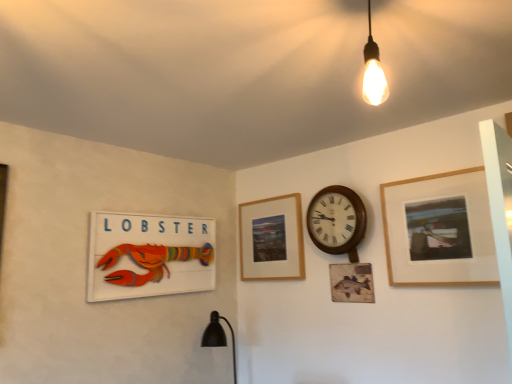
Question: Are wooden picture frame at center, which is the second picture frame in right-to-left order, and wooden lobster sign at left, positioned as the 3th picture frame in right-to-left order, far apart?

Choices:
 (A) yes
 (B) no

Answer: (B)

Question: From the image's perspective, is wooden picture frame at center, which ranks as the 2th picture frame in left-to-right order, on top of wooden lobster sign at left, marked as the first picture frame in a left-to-right arrangement?

Choices:
 (A) no
 (B) yes

Answer: (B)

Question: Is the depth of wooden picture frame at center, which ranks as the 2th picture frame in left-to-right order, greater than that of wooden lobster sign at left, positioned as the 3th picture frame in right-to-left order?

Choices:
 (A) no
 (B) yes

Answer: (B)

Question: From the image's perspective, is wooden picture frame at center, which is the second picture frame in right-to-left order, located beneath wooden lobster sign at left, positioned as the 3th picture frame in right-to-left order?

Choices:
 (A) yes
 (B) no

Answer: (B)

Question: Is wooden picture frame at center, which ranks as the 2th picture frame in left-to-right order, thinner than wooden lobster sign at left, positioned as the 3th picture frame in right-to-left order?

Choices:
 (A) yes
 (B) no

Answer: (A)

Question: From the image's perspective, relative to wooden lobster sign at left, positioned as the 3th picture frame in right-to-left order, is wooden picture frame at center, which ranks as the 2th picture frame in left-to-right order, above or below?

Choices:
 (A) below
 (B) above

Answer: (B)

Question: Considering their positions, is wooden picture frame at center, which is the second picture frame in right-to-left order, located in front of or behind wooden lobster sign at left, positioned as the 3th picture frame in right-to-left order?

Choices:
 (A) front
 (B) behind

Answer: (B)

Question: From a real-world perspective, is wooden picture frame at center, which ranks as the 2th picture frame in left-to-right order, physically located above or below wooden lobster sign at left, marked as the first picture frame in a left-to-right arrangement?

Choices:
 (A) above
 (B) below

Answer: (A)

Question: Does point (269, 248) appear closer or farther from the camera than point (109, 254)?

Choices:
 (A) farther
 (B) closer

Answer: (A)

Question: Based on their sizes in the image, would you say wooden picture frame at center, which is the second picture frame in right-to-left order, is bigger or smaller than wooden clock at center-right?

Choices:
 (A) small
 (B) big

Answer: (A)

Question: Looking at their shapes, would you say wooden picture frame at center, which ranks as the 2th picture frame in left-to-right order, is wider or thinner than wooden clock at center-right?

Choices:
 (A) thin
 (B) wide

Answer: (A)

Question: Do you think wooden picture frame at center, which is the second picture frame in right-to-left order, is within wooden clock at center-right, or outside of it?

Choices:
 (A) inside
 (B) outside

Answer: (B)

Question: From a real-world perspective, is wooden picture frame at center, which ranks as the 2th picture frame in left-to-right order, positioned above or below wooden clock at center-right?

Choices:
 (A) below
 (B) above

Answer: (A)

Question: Considering their positions, is wooden clock at center-right located in front of or behind wooden lobster sign at left, positioned as the 3th picture frame in right-to-left order?

Choices:
 (A) behind
 (B) front

Answer: (A)

Question: From the image's perspective, is wooden clock at center-right above or below wooden lobster sign at left, marked as the first picture frame in a left-to-right arrangement?

Choices:
 (A) above
 (B) below

Answer: (A)